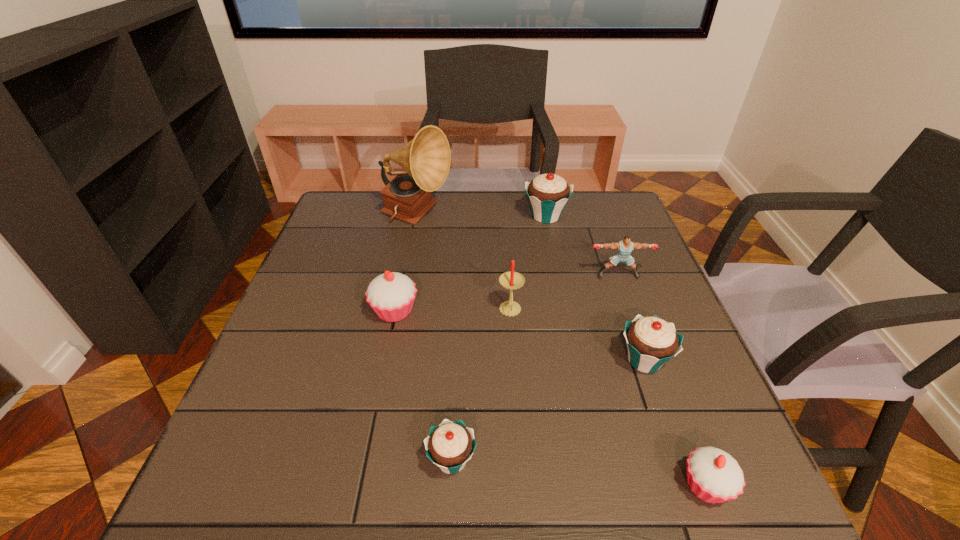
Image resolution: width=960 pixels, height=540 pixels. In order to click on vacant region at the left edge of the desktop in this screenshot , I will do `click(281, 315)`.

The width and height of the screenshot is (960, 540). What are the coordinates of `free spot at the near left corner of the desktop` in the screenshot? It's located at (206, 489).

Identify the location of vacant region at the far right corner of the desktop. The height and width of the screenshot is (540, 960). (605, 215).

Find the location of `empty space between the rightmost teal cupcake and the right pink cupcake`. empty space between the rightmost teal cupcake and the right pink cupcake is located at coordinates [x=675, y=423].

At what (x,y) coordinates should I click in order to perform the action: click on empty location between the rightmost teal cupcake and the bigger pink cupcake. Please return your answer as a coordinate pair (x, y). Looking at the image, I should click on (519, 336).

You are a GUI agent. You are given a task and a screenshot of the screen. Output one action in this format:
    pyautogui.click(x=<x>, y=<y>)
    Task: Click on the vacant point located between the second farthest cupcake and the nearest teal cupcake
    This screenshot has height=540, width=960.
    Given the screenshot: What is the action you would take?
    pyautogui.click(x=423, y=386)

The image size is (960, 540). I want to click on free area in between the red puncher and the fifth object from right to left, so click(x=564, y=293).

Identify the location of blank region between the fourth object from left to right and the red puncher. (564, 293).

At what (x,y) coordinates should I click in order to perform the action: click on free space between the tallest object and the red puncher. Please return your answer as a coordinate pair (x, y). Image resolution: width=960 pixels, height=540 pixels. Looking at the image, I should click on (517, 246).

This screenshot has height=540, width=960. What are the coordinates of `free spot between the nearer pink cupcake and the sixth nearest object` in the screenshot? It's located at (662, 380).